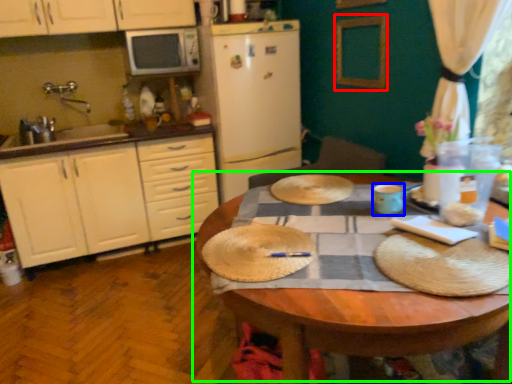
Question: Which object is the farthest from picture frame (highlighted by a red box)? Choose among these: coffee cup (highlighted by a blue box) or table (highlighted by a green box).

Choices:
 (A) coffee cup
 (B) table

Answer: (B)